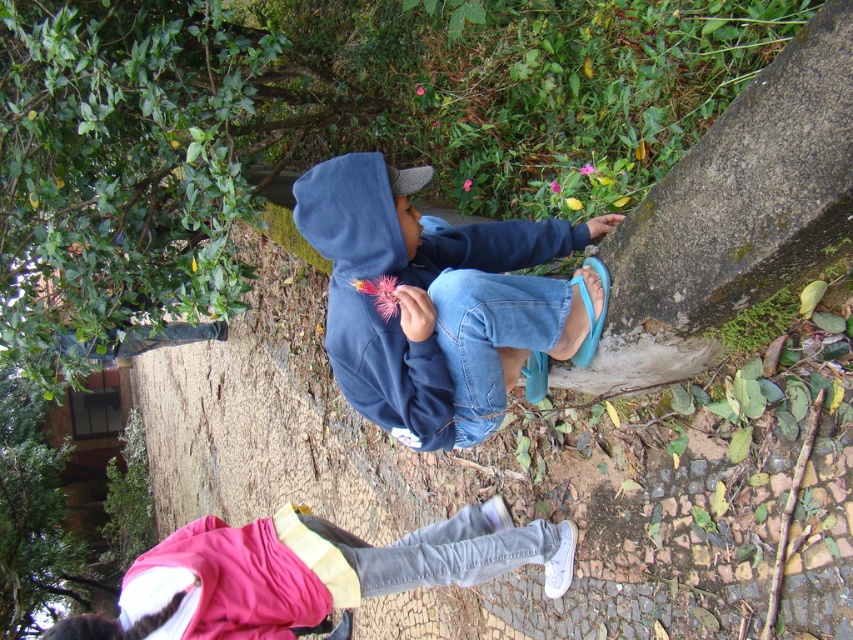
Between navy blue hoodie at center and light blue denim jeans at lower center, which one is positioned lower?

light blue denim jeans at lower center is below.

Does navy blue hoodie at center lie in front of light blue denim jeans at lower center?

Yes.

I want to click on navy blue hoodie at center, so click(x=440, y=300).

Where is `navy blue hoodie at center`? navy blue hoodie at center is located at coordinates (440, 300).